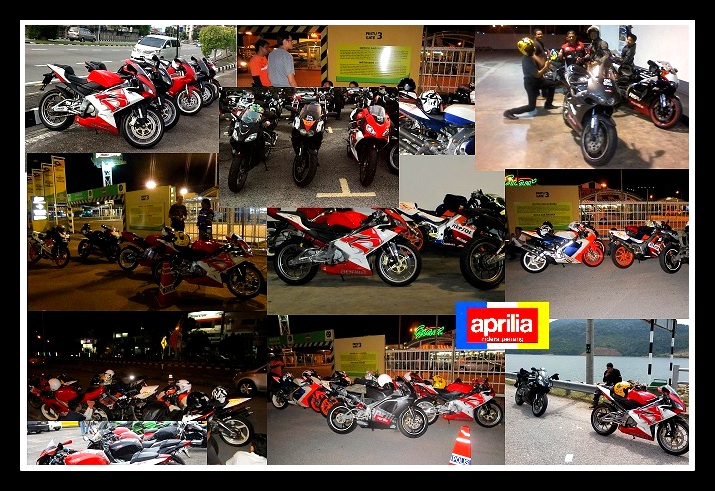
The height and width of the screenshot is (491, 715). In order to click on side rail in this screenshot , I will do `click(576, 387)`.